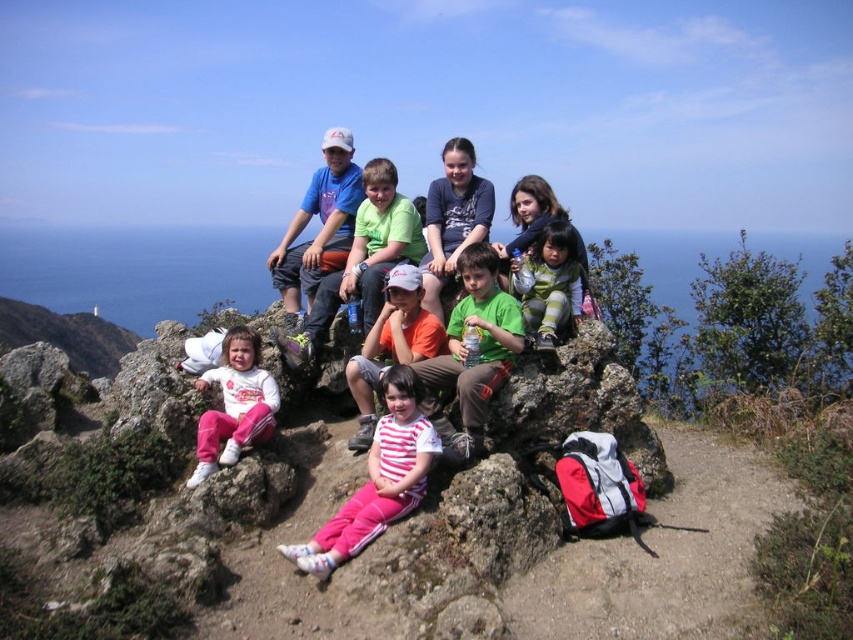
You are one of the children sitting on the rocky outcrop. You want to throw a pebble from the point labeled point [415,452] to the point labeled point [553,339]. Considering the positions of these points, will the pebble have to go uphill or downhill?

The pebble will have to go uphill because point [415,452] is closer to the camera than point [553,339], indicating it is lower in elevation.

You are a photographer trying to capture the striped fabric pants at center and the green fabric jacket at center in the same frame. Since you want to ensure both are visible, which one should you position closer to the left side of your camera viewfinder to include both?

To include both the striped fabric pants at center and the green fabric jacket at center in the frame, position the striped fabric pants at center closer to the left side of the camera viewfinder since it is already to the left of the green fabric jacket at center.

You are a photographer trying to capture the striped cotton shirt at center in your shot. Based on its position, where should you aim your camera?

The striped cotton shirt at center is located at the 2D coordinates point (392, 344), so aim your camera towards that point to capture it.